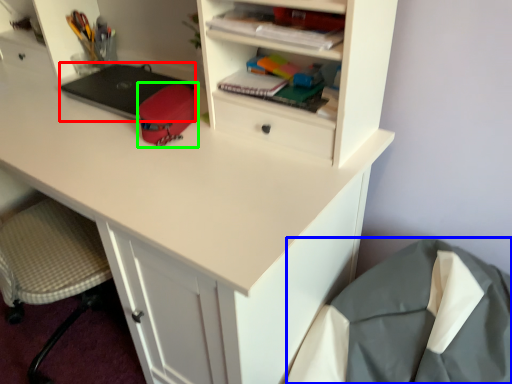
Question: Estimate the real-world distances between objects in this image. Which object is farther from laptop (highlighted by a red box), sleeping bag (highlighted by a blue box) or stationery (highlighted by a green box)?

Choices:
 (A) sleeping bag
 (B) stationery

Answer: (A)